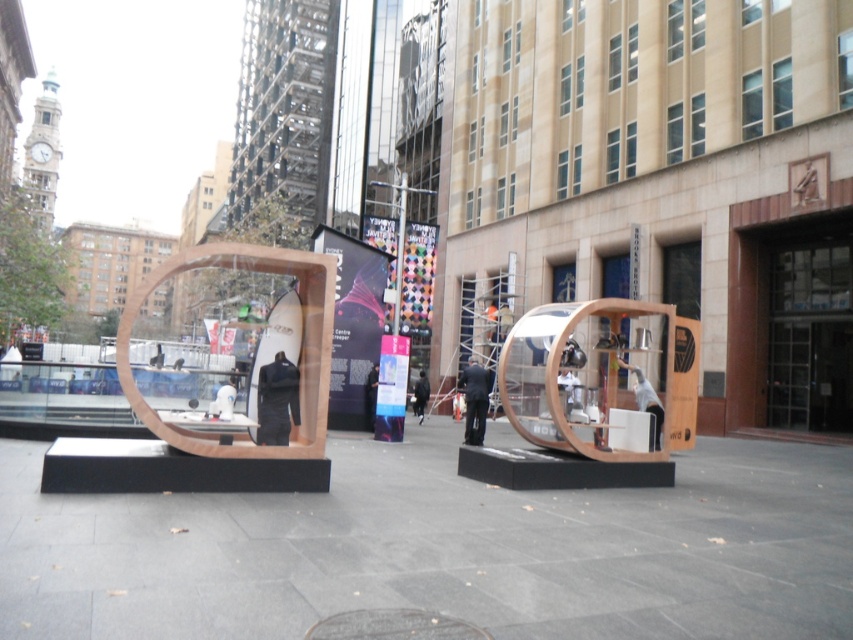
Question: Does wooden sculpture at center have a larger size compared to white fabric bag at center?

Choices:
 (A) no
 (B) yes

Answer: (B)

Question: Among these objects, which one is farthest from the camera?

Choices:
 (A) dark suit at center
 (B) dark fabric jacket at center
 (C) white fabric bag at center
 (D) black fabric jacket at center

Answer: (D)

Question: Which object is positioned farthest from the black fabric at center?

Choices:
 (A) white fabric bag at center
 (B) wooden sculpture at center
 (C) black fabric jacket at center
 (D) dark suit at center

Answer: (A)

Question: Is the position of wooden sculpture at center less distant than that of white fabric bag at center?

Choices:
 (A) yes
 (B) no

Answer: (A)

Question: Observing the image, what is the correct spatial positioning of dark fabric jacket at center in reference to dark suit at center?

Choices:
 (A) above
 (B) below

Answer: (A)

Question: Which point is farther to the camera?

Choices:
 (A) (367, 403)
 (B) (262, 442)
 (C) (421, 406)
 (D) (485, 384)

Answer: (C)